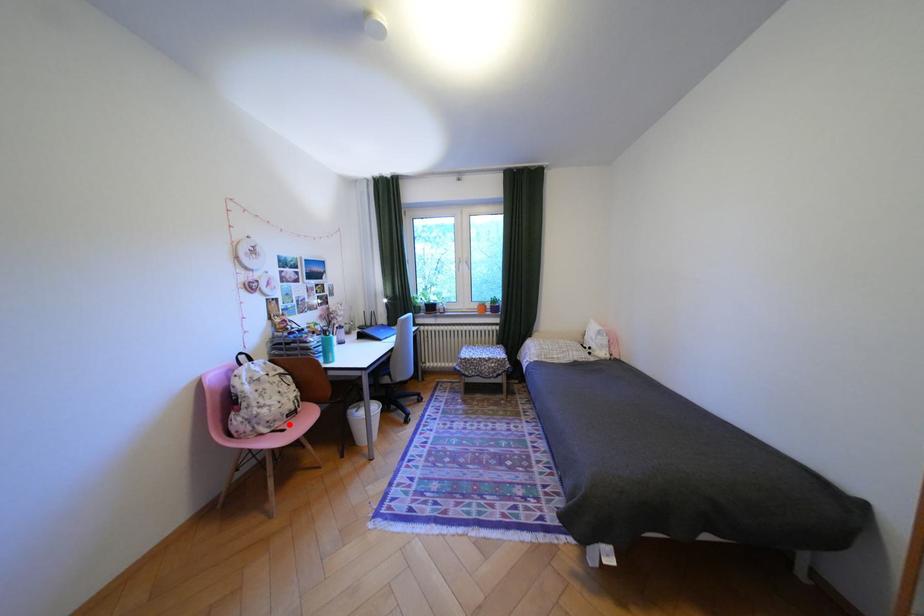
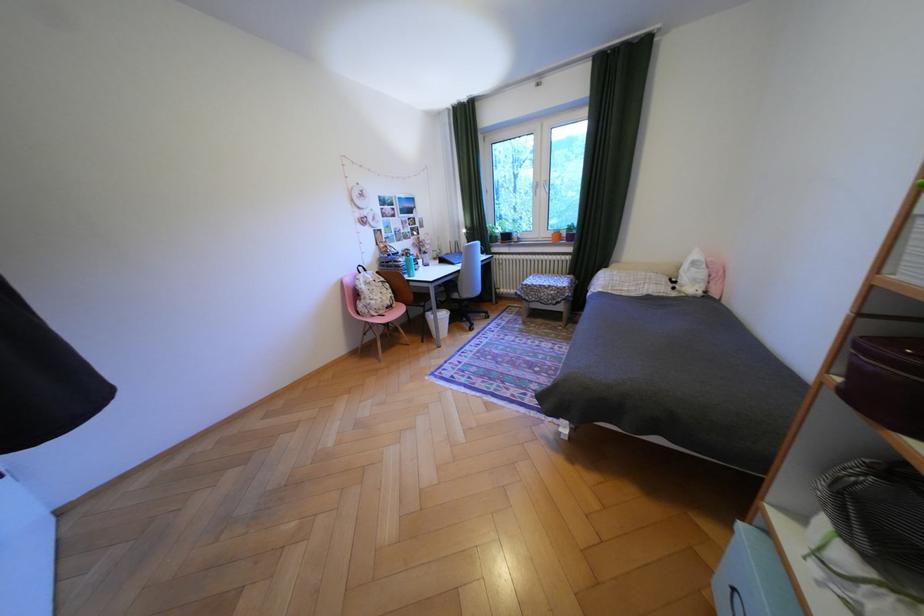
Question: A red point is marked in image1. In image2, is the corresponding 3D point closer to the camera or farther? Reply with the corresponding letter.

Choices:
 (A) The corresponding 3D point is closer.
 (B) The corresponding 3D point is farther.

Answer: (A)